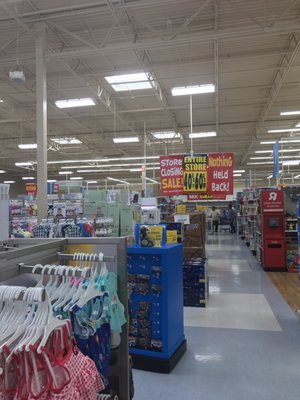
The width and height of the screenshot is (300, 400). I want to click on ceiling, so click(x=230, y=76).